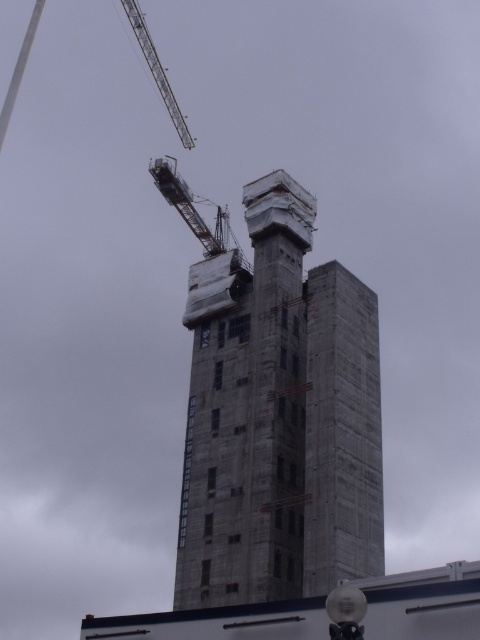
You are a construction worker standing at the base of the building. You need to move a heavy beam from the concrete at center to the metallic gray crane at upper left. Which object is closer to your current position?

The concrete at center is closer to the viewer than the metallic gray crane at upper left, so the concrete at center is closer to your current position.

You are a construction worker assessing the height of the concrete at center and the metallic gray crane at upper left. Which object is shorter?

The concrete at center is shorter than the metallic gray crane at upper left.